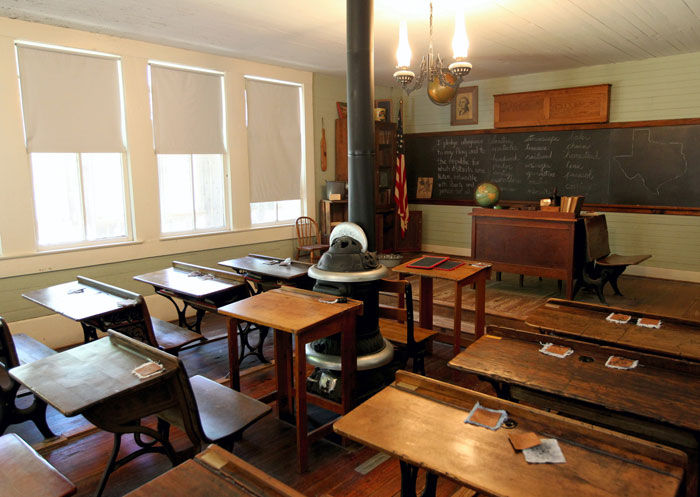
Locate an element on the screen. window shades is located at coordinates (88, 111), (194, 117), (276, 146).